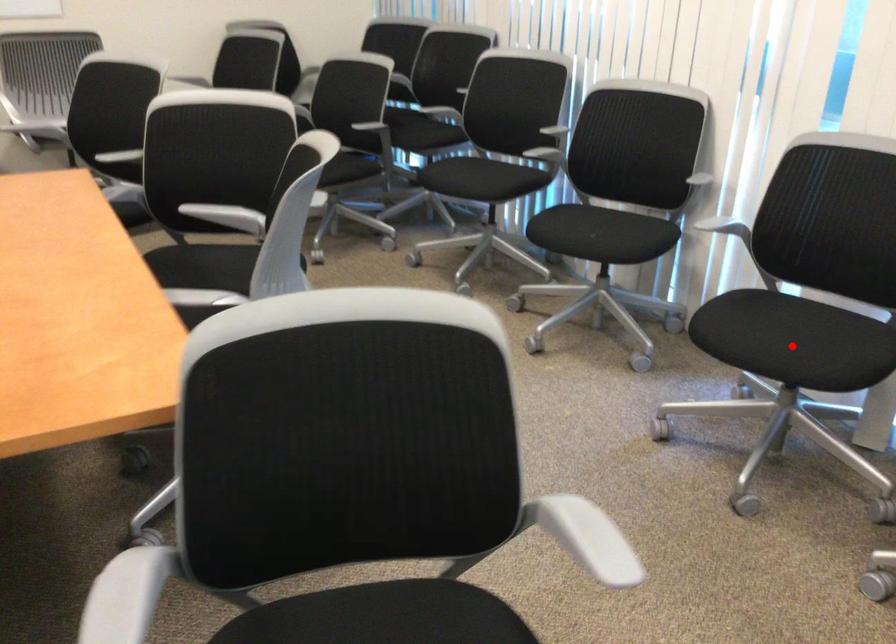
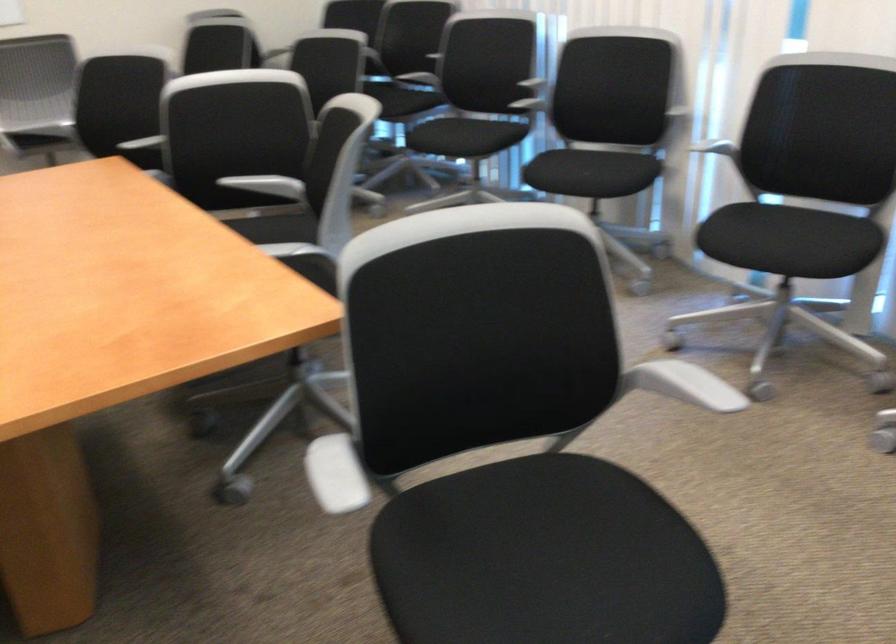
Question: I am providing you with two images of the same scene from different viewpoints. Given a red point in image1, look at the same physical point in image2. Is it:

Choices:
 (A) Closer to the viewpoint
 (B) Farther from the viewpoint

Answer: (B)